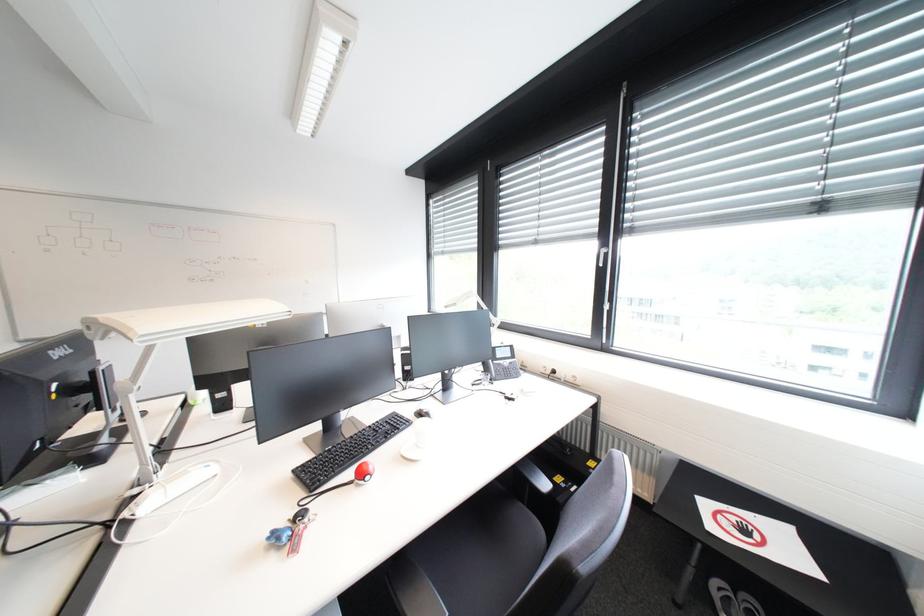
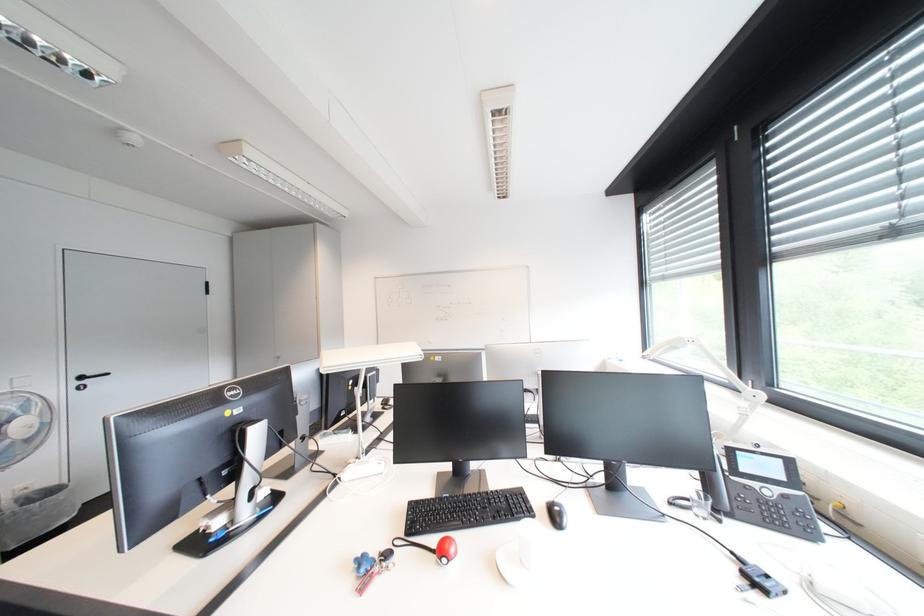
Question: How did the camera likely rotate?

Choices:
 (A) Left
 (B) Right
 (C) Up
 (D) Down

Answer: (A)